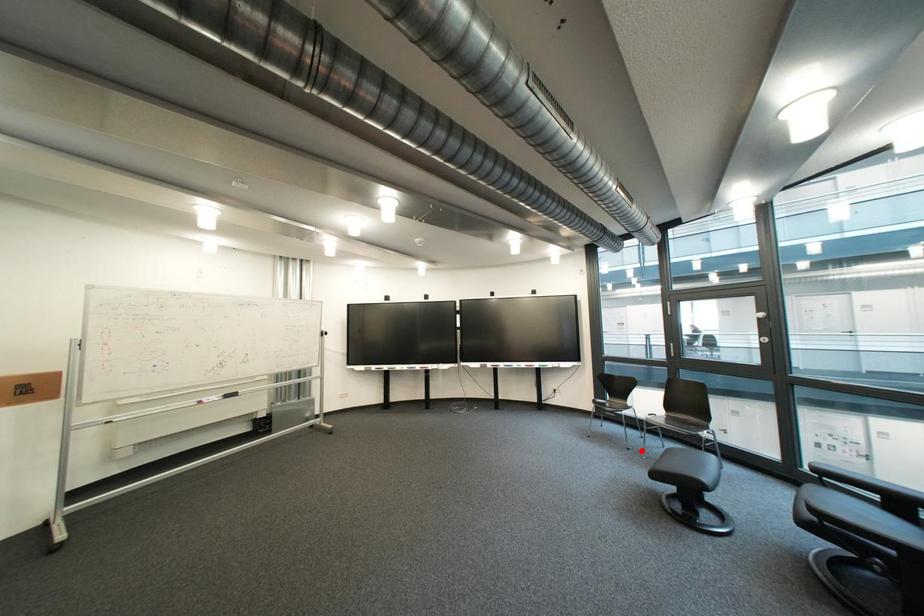
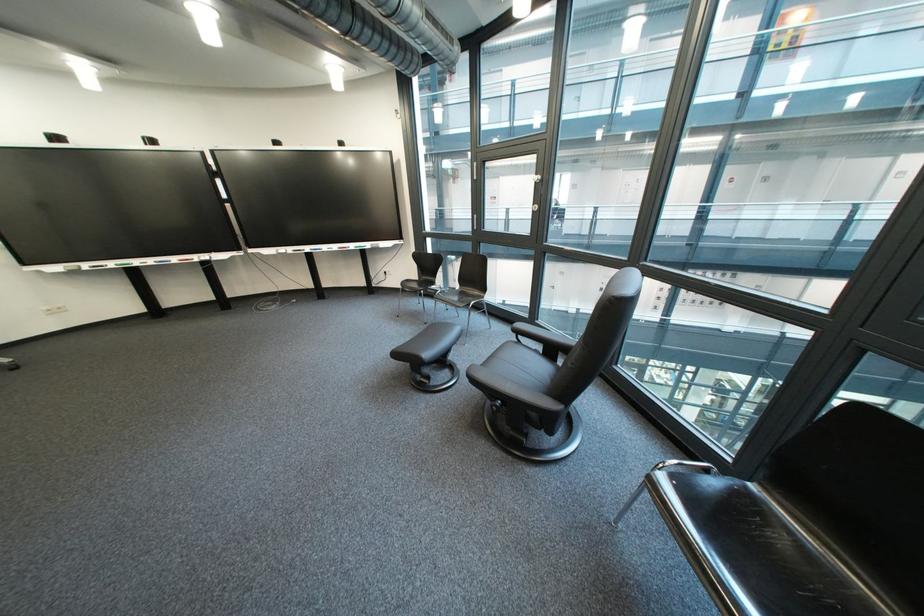
Question: I am providing you with two images of the same scene from different viewpoints. Image1 has a red point marked. In image2, the corresponding 3D location appears at what relative position? Reply with the corresponding letter.

Choices:
 (A) Closer
 (B) Farther

Answer: (B)